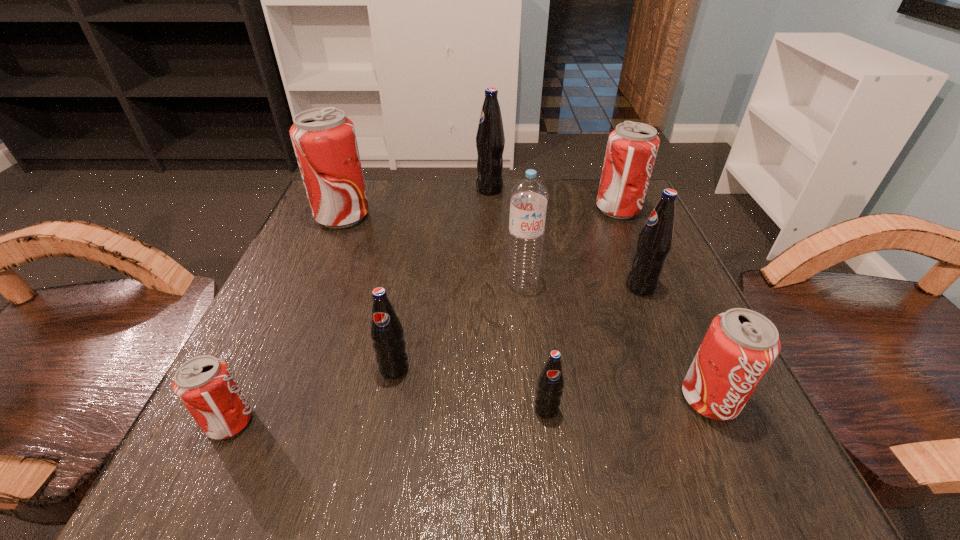
Locate an element on the screen. vacant region located on the front label of the rightmost black pop is located at coordinates (459, 287).

The width and height of the screenshot is (960, 540). I want to click on vacant space located 0.340m on the front label of the rightmost black pop, so tap(437, 287).

This screenshot has width=960, height=540. I want to click on free location located on the front label of the leftmost black pop, so click(375, 468).

Where is `vacant space situated 0.060m on the front of the third biggest pink soda can`? The image size is (960, 540). vacant space situated 0.060m on the front of the third biggest pink soda can is located at coordinates (741, 469).

Locate an element on the screen. This screenshot has height=540, width=960. vacant space located on the back of the smallest pink soda can is located at coordinates (284, 307).

Find the location of a particular element. The width and height of the screenshot is (960, 540). free space located on the front label of the nearest black pop is located at coordinates (552, 455).

At what (x,y) coordinates should I click in order to perform the action: click on object that is positioned at the far left corner. Please return your answer as a coordinate pair (x, y). Looking at the image, I should click on click(x=324, y=140).

Find the location of `object that is at the near left corner`. object that is at the near left corner is located at coordinates (205, 385).

Identify the location of object located at the far right corner. The image size is (960, 540). (632, 147).

Identify the location of object that is at the near right corner. This screenshot has height=540, width=960. [740, 346].